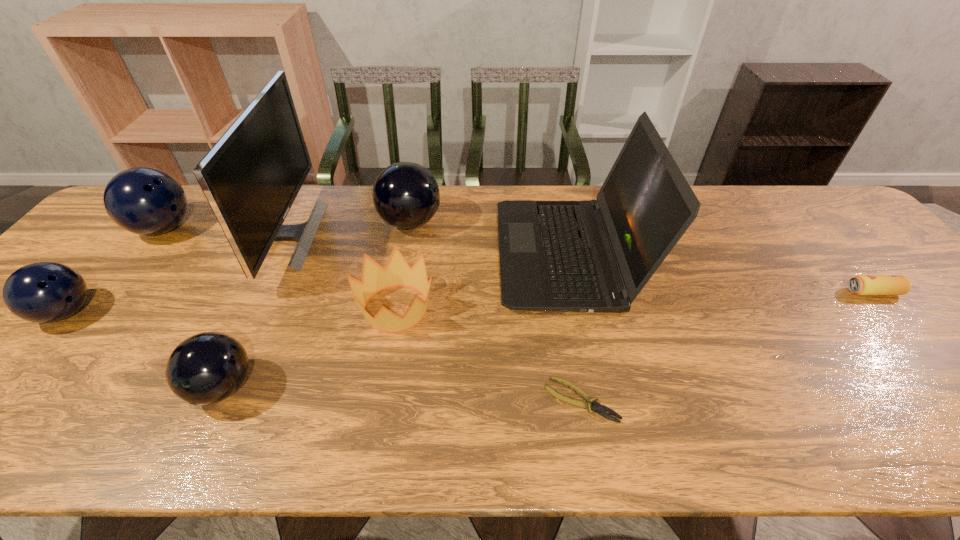
Identify the location of monitor. This screenshot has height=540, width=960. (252, 175).

Find the location of a particular element. The width and height of the screenshot is (960, 540). gray laptop_computer is located at coordinates (593, 255).

Image resolution: width=960 pixels, height=540 pixels. I want to click on laptop_computer, so click(x=593, y=255).

Locate an element on the screen. the farther blue bowling ball is located at coordinates (145, 201).

Where is `the right black bowling ball`? This screenshot has width=960, height=540. the right black bowling ball is located at coordinates (406, 195).

Where is `the farther black bowling ball`? Image resolution: width=960 pixels, height=540 pixels. the farther black bowling ball is located at coordinates (406, 195).

At what (x,y) coordinates should I click in order to perform the action: click on the second nearest bowling ball. Please return your answer as a coordinate pair (x, y). The height and width of the screenshot is (540, 960). Looking at the image, I should click on (43, 292).

Find the location of a particular element. This screenshot has width=960, height=540. the smaller blue bowling ball is located at coordinates (43, 292).

Locate an element on the screen. the third bowling ball from left to right is located at coordinates (206, 368).

This screenshot has height=540, width=960. I want to click on the nearer black bowling ball, so click(x=206, y=368).